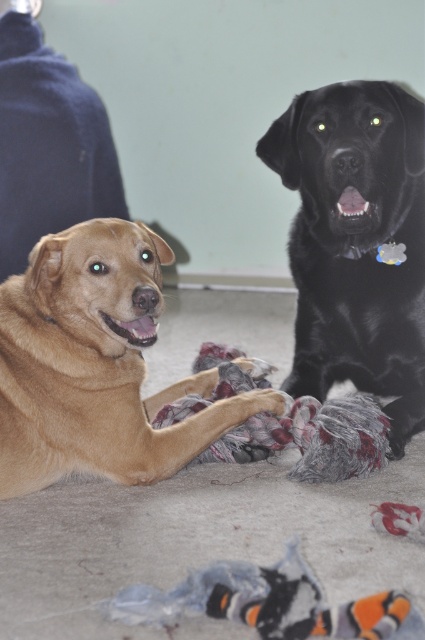
Where is the golden brown fur at center located in the image?

The golden brown fur at center is located at point (96,364).

You are a dog owner who wants to buy a new collar for your dogs. The golden brown fur at center and the black glossy dog at upper right are both in the room. Which dog requires a larger collar based on their size?

The black glossy dog at upper right requires a larger collar because it is taller than the golden brown fur at center.

You are a photographer trying to capture both the golden brown fur at center and the black glossy dog at upper right in a single shot. Based on their positions, which dog is closer to the camera?

The golden brown fur at center is positioned under the black glossy dog at upper right, meaning the black glossy dog at upper right is closer to the camera than the golden brown fur at center.